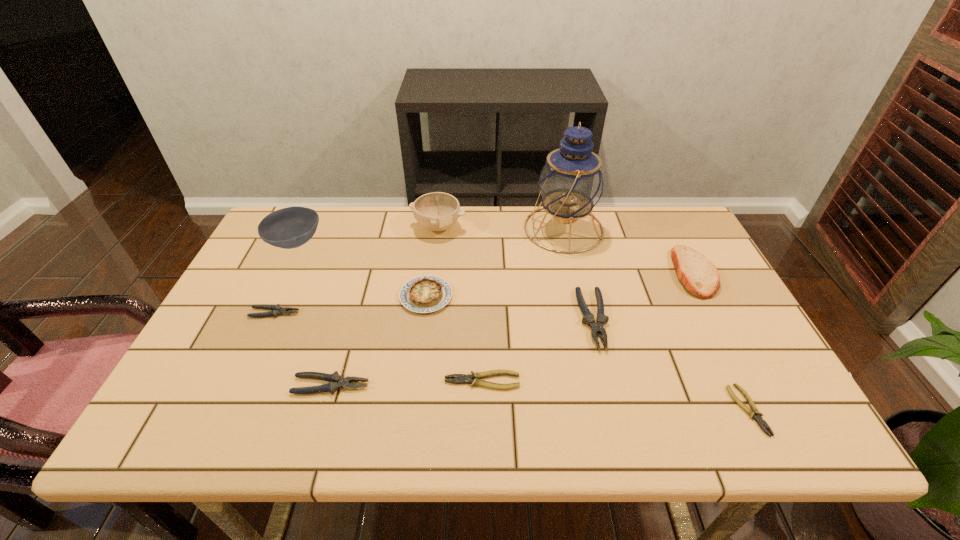
You are a GUI agent. You are given a task and a screenshot of the screen. Output one action in this format:
    pyautogui.click(x=<x>, y=<y>)
    Task: Click on the object that is at the near edge
    This screenshot has width=960, height=540.
    Given the screenshot: What is the action you would take?
    pyautogui.click(x=754, y=413)

Where is `bowl that is at the left edge`? This screenshot has width=960, height=540. bowl that is at the left edge is located at coordinates (291, 227).

You are a GUI agent. You are given a task and a screenshot of the screen. Output one action in this format:
    pyautogui.click(x=<x>, y=<y>)
    Task: Click on the pliers that is positioned at the left edge
    
    Given the screenshot: What is the action you would take?
    pyautogui.click(x=277, y=310)

Identify the location of pita bread at the right edge. This screenshot has height=540, width=960. (700, 277).

At what (x,y) coordinates should I click in order to perform the action: click on pliers that is at the right edge. Please return your answer as a coordinate pair (x, y). Looking at the image, I should click on (754, 413).

In order to click on object located in the far left corner section of the desktop in this screenshot , I will do `click(291, 227)`.

Locate an element on the screen. This screenshot has height=540, width=960. object that is positioned at the far right corner is located at coordinates (700, 277).

In order to click on object located at the near right corner in this screenshot , I will do `click(754, 413)`.

The width and height of the screenshot is (960, 540). In order to click on free space at the far edge in this screenshot , I will do `click(484, 251)`.

Identify the location of free location at the near edge of the desktop. (272, 433).